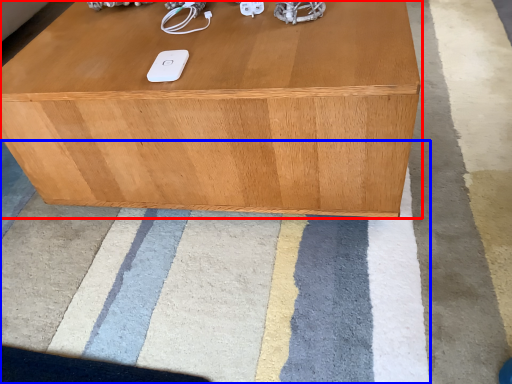
Question: Which object appears closest to the camera in this image, table (highlighted by a red box) or mat (highlighted by a blue box)?

Choices:
 (A) table
 (B) mat

Answer: (B)